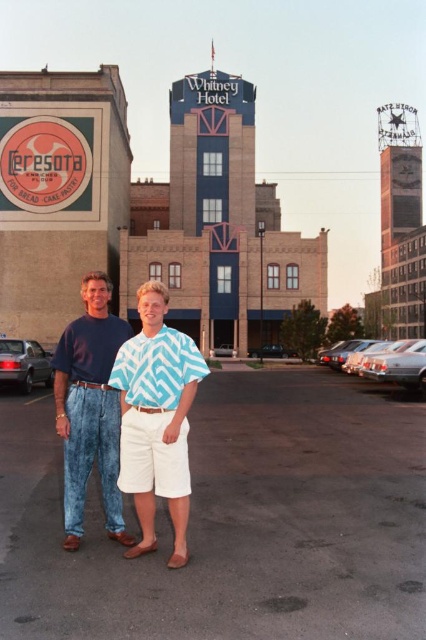
Can you confirm if denim pants at center is positioned to the left of shiny silver sedan at right?

Indeed, denim pants at center is positioned on the left side of shiny silver sedan at right.

Describe the element at coordinates (89, 408) in the screenshot. Image resolution: width=426 pixels, height=640 pixels. I see `denim pants at center` at that location.

This screenshot has width=426, height=640. What do you see at coordinates (89, 408) in the screenshot?
I see `denim pants at center` at bounding box center [89, 408].

I want to click on denim pants at center, so click(89, 408).

Does point (57, 433) come farther from viewer compared to point (40, 355)?

No, (57, 433) is closer to viewer.

Can you confirm if denim pants at center is smaller than silver metallic sedan at left?

Actually, denim pants at center might be larger than silver metallic sedan at left.

This screenshot has height=640, width=426. Identify the location of denim pants at center. (89, 408).

Does blue zigzag shirt at center have a lesser width compared to silver metallic sedan at center?

Indeed, blue zigzag shirt at center has a lesser width compared to silver metallic sedan at center.

In the scene shown: Which is more to the left, blue zigzag shirt at center or silver metallic sedan at center?

blue zigzag shirt at center is more to the left.

Where is `blue zigzag shirt at center`? blue zigzag shirt at center is located at coordinates (157, 419).

Where is `blue zigzag shirt at center`? Image resolution: width=426 pixels, height=640 pixels. blue zigzag shirt at center is located at coordinates (157, 419).